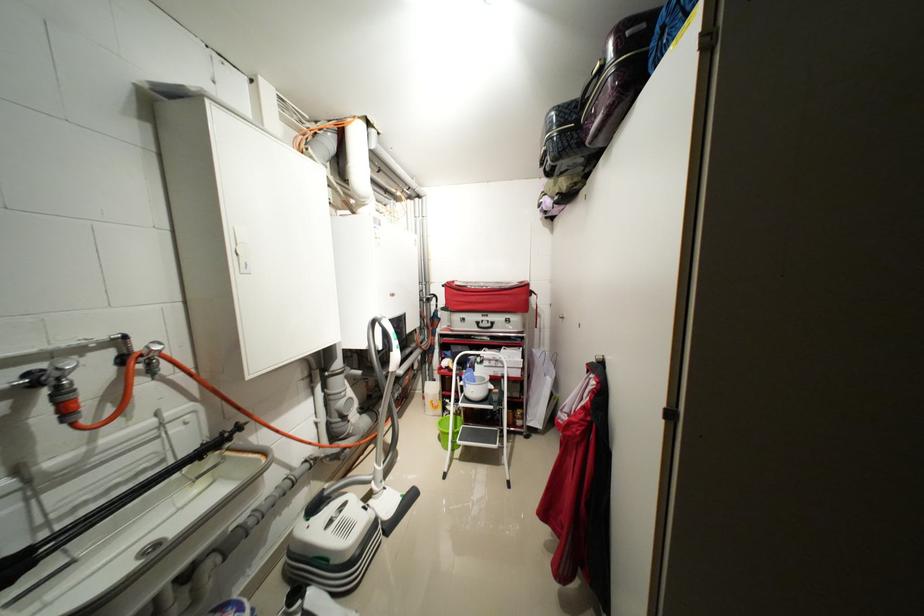
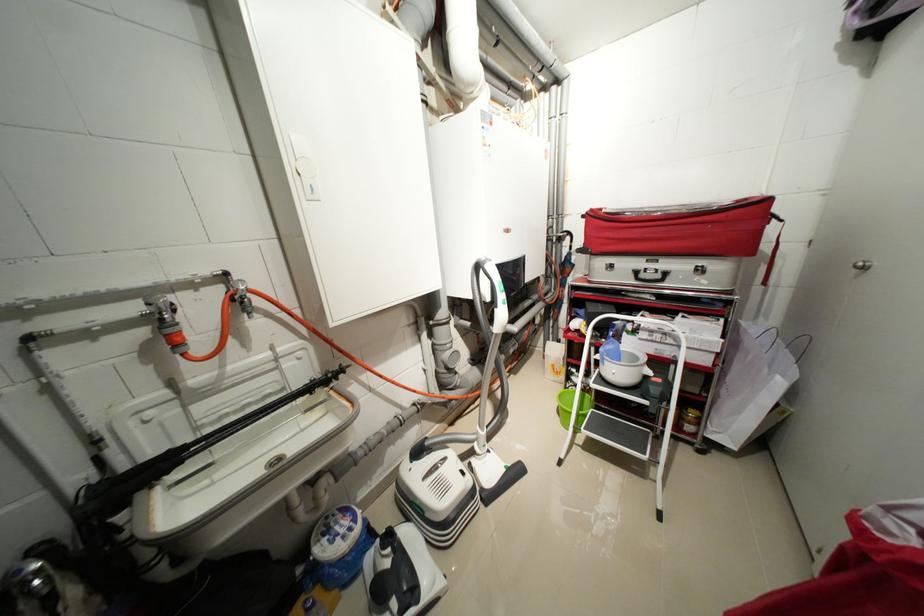
Locate, in the second image, the point that corresponds to [455,284] in the first image.

(599, 211)